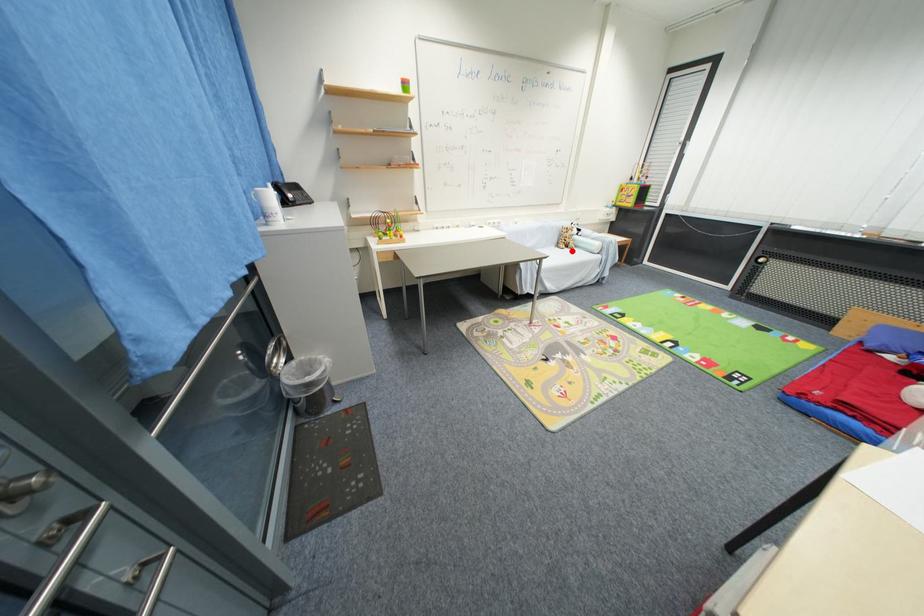
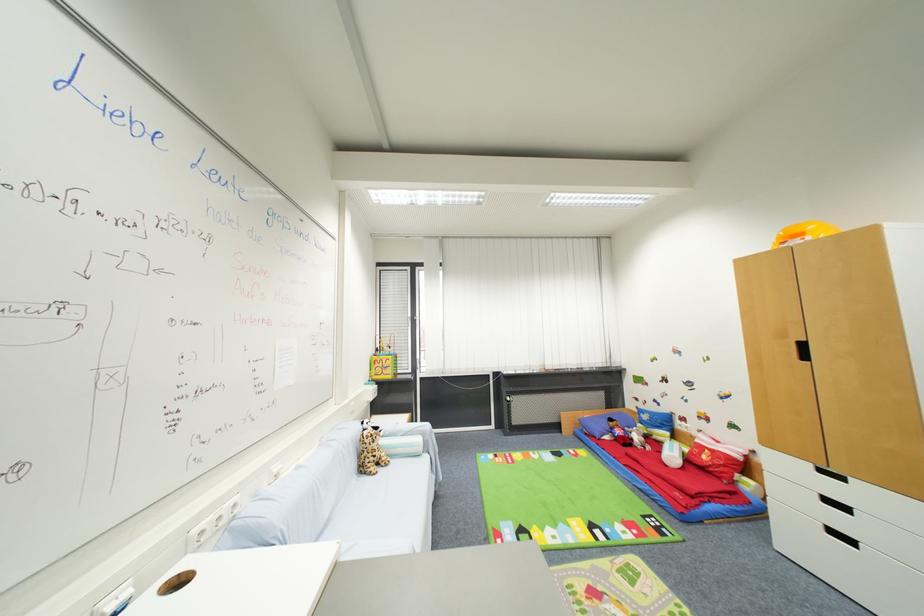
Question: I am providing you with two images of the same scene from different viewpoints. A red point is marked on the first image. At the location where the point appears in image 1, is it still visible in image 2?

Choices:
 (A) Yes
 (B) No

Answer: (A)